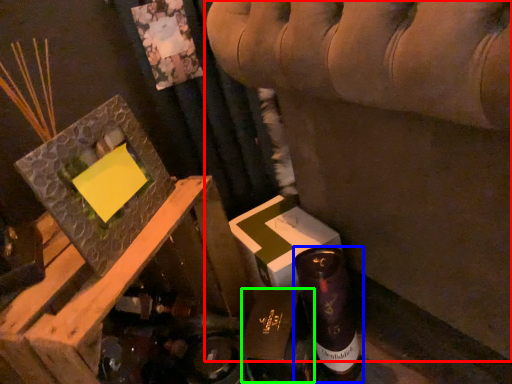
Question: Considering the real-world distances, which object is farthest from furniture (highlighted by a red box)? bottle (highlighted by a blue box) or cardboard box (highlighted by a green box)?

Choices:
 (A) bottle
 (B) cardboard box

Answer: (B)